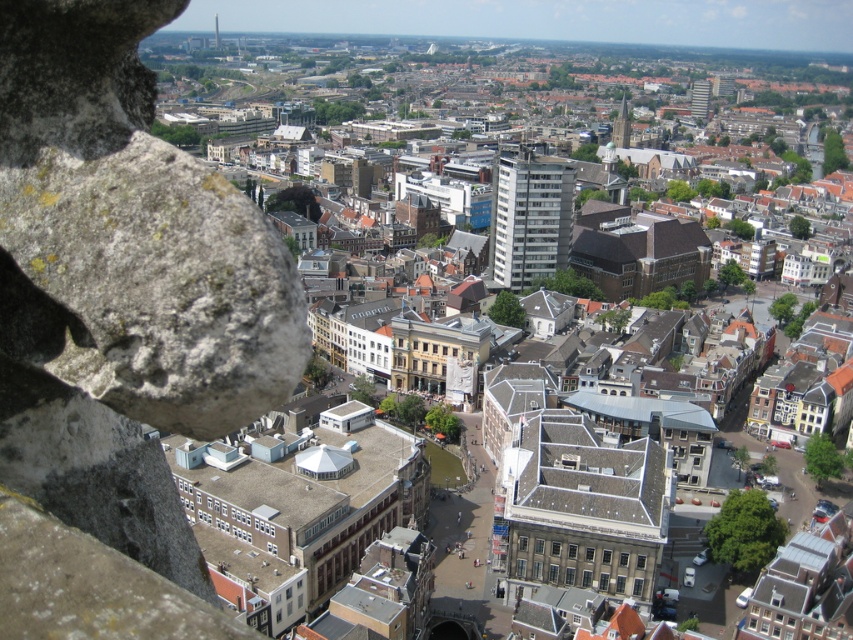
Question: Which object appears farthest from the camera in this image?

Choices:
 (A) white smooth building at center
 (B) smooth gray tower at upper center
 (C) light gray concrete building at upper center

Answer: (C)

Question: Which of the following is the closest to the observer?

Choices:
 (A) dark gray stone tower at center
 (B) white smooth building at center

Answer: (B)

Question: Does dark gray stone tower at center appear over smooth gray tower at upper center?

Choices:
 (A) no
 (B) yes

Answer: (A)

Question: Which point appears farthest from the camera in this image?

Choices:
 (A) tap(700, 88)
 (B) tap(619, 145)
 (C) tap(500, 180)

Answer: (A)

Question: Can you confirm if dark gray stone tower at center is positioned to the left of smooth gray tower at upper center?

Choices:
 (A) no
 (B) yes

Answer: (A)

Question: Does white smooth building at center appear on the right side of smooth gray tower at upper center?

Choices:
 (A) no
 (B) yes

Answer: (B)